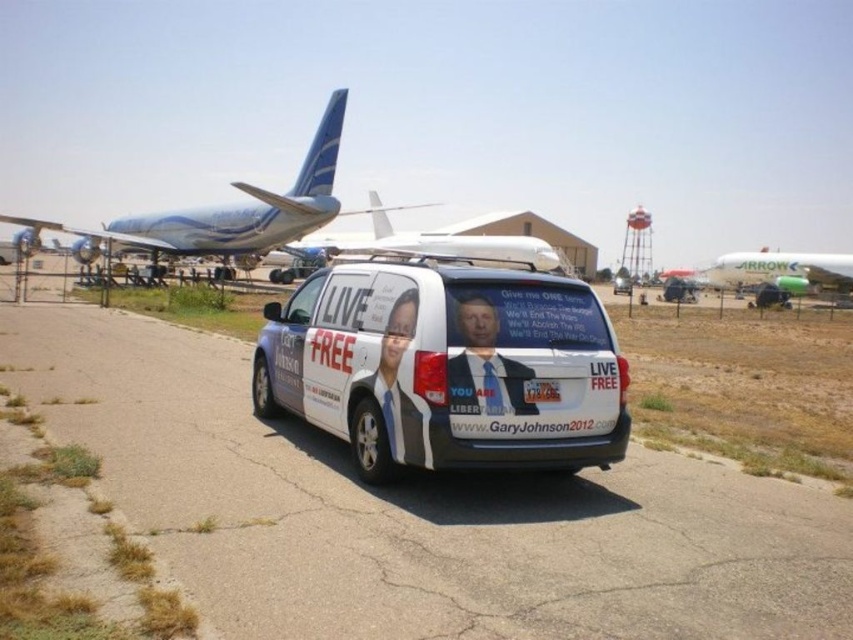
Consider the image. You are standing at the point closest to the van. Which of the two points, point (x=558, y=333) or point (x=462, y=392), is farther away from you?

Point (x=558, y=333) is behind point (x=462, y=392), so it is farther away from you.

You are a pilot preparing to taxi your plane to the runway. You see the white asphalt tarmac at center and the white matte airplane at center. Which object is shorter in height?

The white asphalt tarmac at center is shorter than the white matte airplane at center.